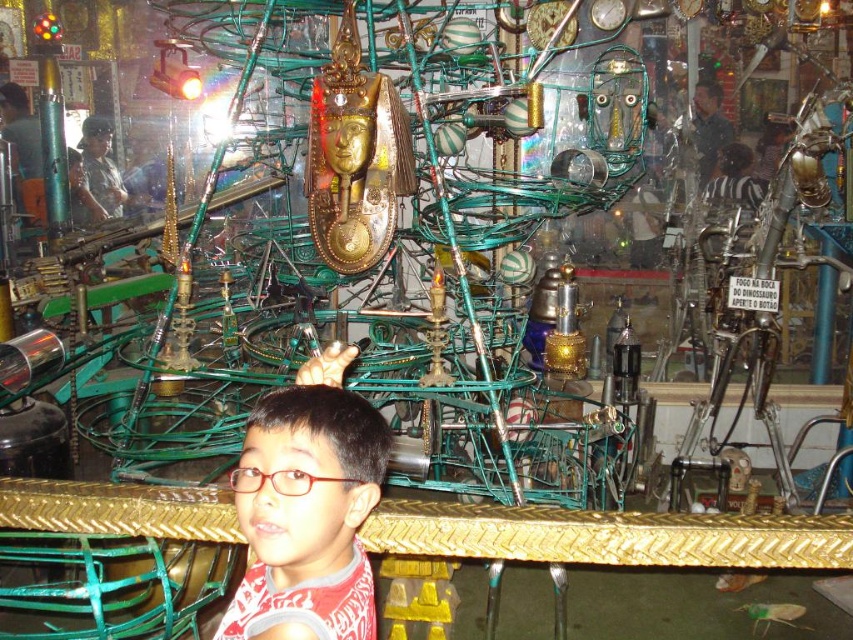
Who is taller, red matte shirt at center or red plastic glasses at center?

red matte shirt at center is taller.

Who is more forward, (314, 484) or (245, 477)?

Point (314, 484) is in front.

Locate an element on the screen. The width and height of the screenshot is (853, 640). red matte shirt at center is located at coordinates (306, 508).

This screenshot has width=853, height=640. Find the location of `red matte shirt at center`. red matte shirt at center is located at coordinates (306, 508).